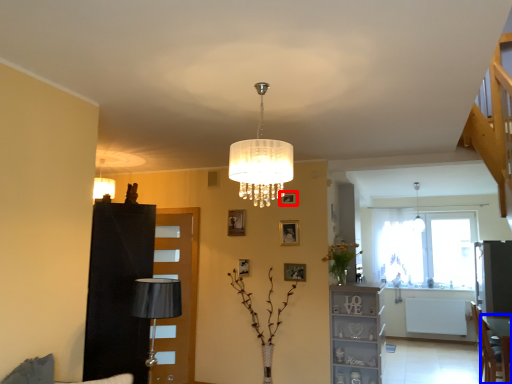
Question: Which object is further to the camera taking this photo, picture frame (highlighted by a red box) or table (highlighted by a blue box)?

Choices:
 (A) picture frame
 (B) table

Answer: (A)